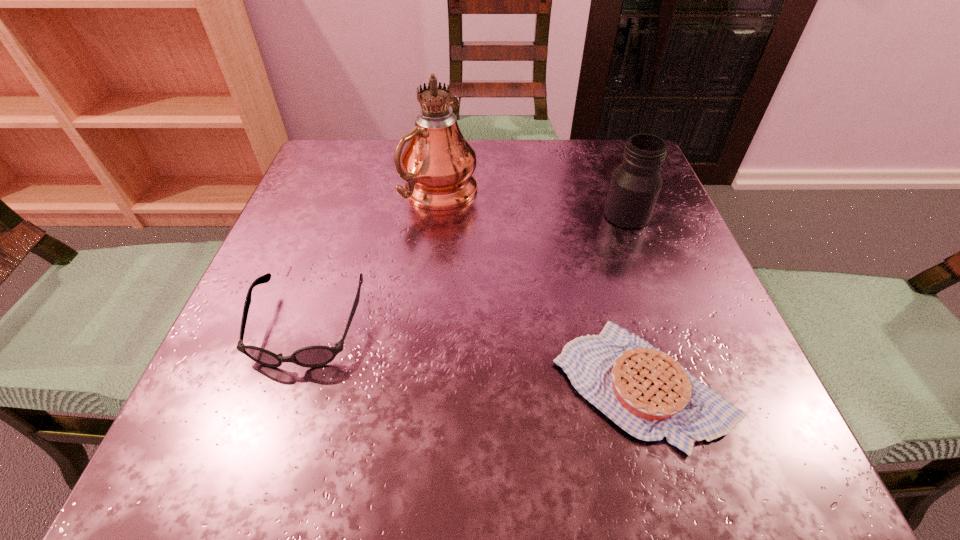
The width and height of the screenshot is (960, 540). I want to click on vacant area at the far left corner of the desktop, so click(351, 148).

What are the coordinates of `vacant space at the far right corner` in the screenshot? It's located at (619, 140).

Where is `vacant space in between the second tallest object and the second object from left to right`? The height and width of the screenshot is (540, 960). vacant space in between the second tallest object and the second object from left to right is located at coordinates (534, 204).

Find the location of `vacant point located between the second object from left to right and the pie`. vacant point located between the second object from left to right and the pie is located at coordinates (541, 288).

Where is `vacant space that's between the oil lamp and the jar`? vacant space that's between the oil lamp and the jar is located at coordinates (534, 204).

Image resolution: width=960 pixels, height=540 pixels. I want to click on vacant area between the second shortest object and the jar, so click(x=468, y=271).

Locate an element on the screen. empty space between the second shortest object and the jar is located at coordinates (468, 271).

This screenshot has width=960, height=540. I want to click on free space between the third tallest object and the pie, so click(475, 355).

Find the location of a particular element. The width and height of the screenshot is (960, 540). free space between the oil lamp and the third tallest object is located at coordinates (374, 260).

The height and width of the screenshot is (540, 960). Identify the location of empty location between the third tallest object and the pie. (475, 355).